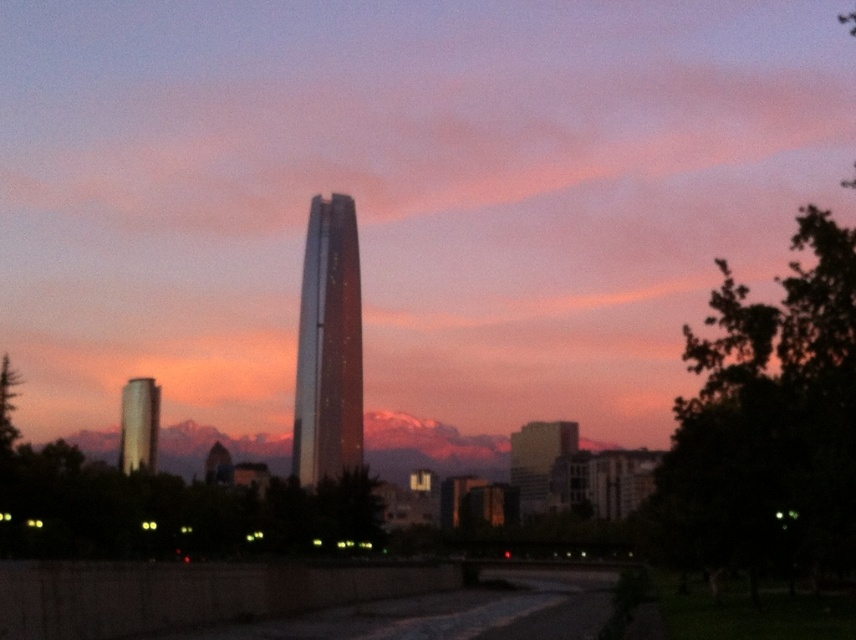
You are a city planner evaluating the skyline. Based on the image, which of the two towers, the shiny glass tower at center or the shiny silver tower at left, would cast a longer shadow during the day?

The shiny glass tower at center is taller than the shiny silver tower at left, so it would cast a longer shadow during the day.

You are standing at the base of the skyscraper and want to walk towards the point marked as point (x=293, y=429). Will you pass by point (x=522, y=432) before reaching your destination?

Point (x=293, y=429) is in front of point (x=522, y=432), so you will reach point (x=293, y=429) before passing point (x=522, y=432). Therefore, you will not pass by point (x=522, y=432) before reaching your destination.

You are an architect analyzing the cityscape. You notice two central glass structures labeled as the shiny glass tower at center and the smooth glass building at center. Based on their positions in the scene, which one is situated higher in the image?

The shiny glass tower at center is situated higher in the image as it is positioned above the smooth glass building at center.